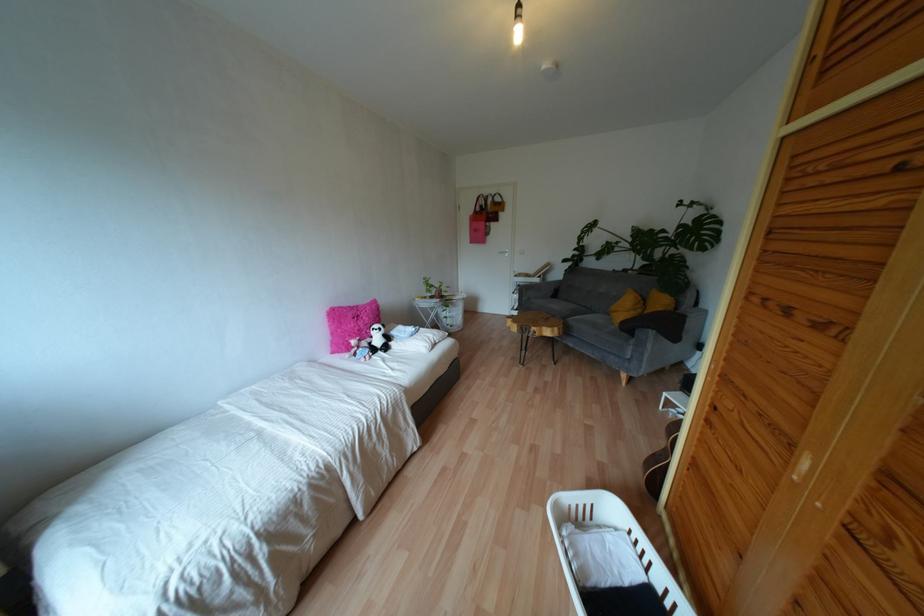
Where would you pull the white door handle? Please return your answer as a coordinate pair (x, y).

(505, 256)